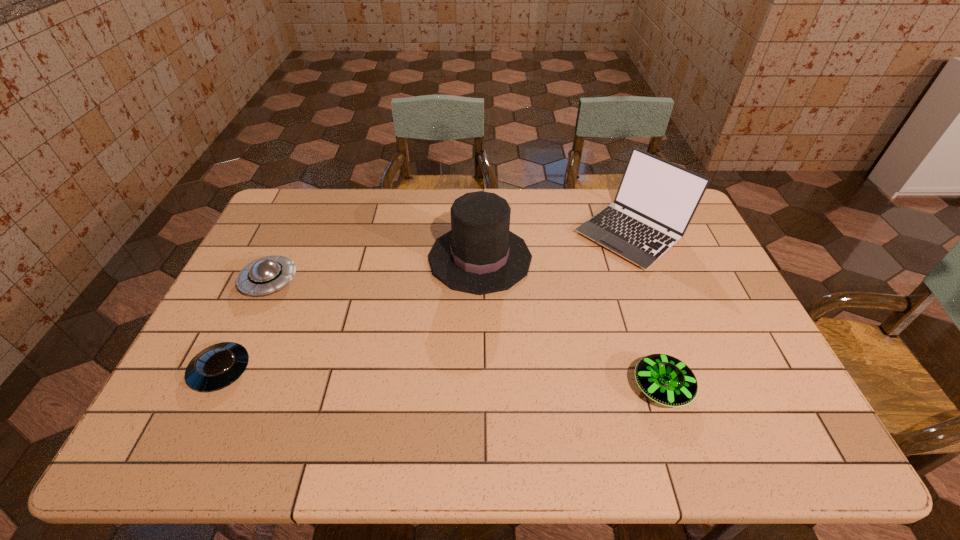
Locate an element on the screen. The width and height of the screenshot is (960, 540). vacant area at the left edge is located at coordinates (282, 236).

Find the location of a particular element. The height and width of the screenshot is (540, 960). free region at the right edge of the desktop is located at coordinates click(778, 407).

This screenshot has height=540, width=960. I want to click on vacant area that lies between the dress hat and the laptop_computer, so click(x=556, y=246).

At what (x,y) coordinates should I click in order to perform the action: click on free point between the shortest object and the laptop_computer. Please return your answer as a coordinate pair (x, y). The width and height of the screenshot is (960, 540). Looking at the image, I should click on coord(426,302).

Locate an element on the screen. The height and width of the screenshot is (540, 960). free space between the laptop_computer and the dress hat is located at coordinates (556, 246).

Locate an element on the screen. free space between the farthest saucer and the shortest saucer is located at coordinates (245, 326).

Where is `free point between the rightmost saucer and the farthest saucer`? The image size is (960, 540). free point between the rightmost saucer and the farthest saucer is located at coordinates (466, 334).

What are the coordinates of `vacant space that's between the farthest saucer and the rightmost saucer` in the screenshot? It's located at (466, 334).

Where is `vacant point located between the farthest saucer and the shortest object`? vacant point located between the farthest saucer and the shortest object is located at coordinates (245, 326).

At what (x,y) coordinates should I click in order to perform the action: click on free space between the shortest object and the dress hat. Please return your answer as a coordinate pair (x, y). The image size is (960, 540). Looking at the image, I should click on (350, 314).